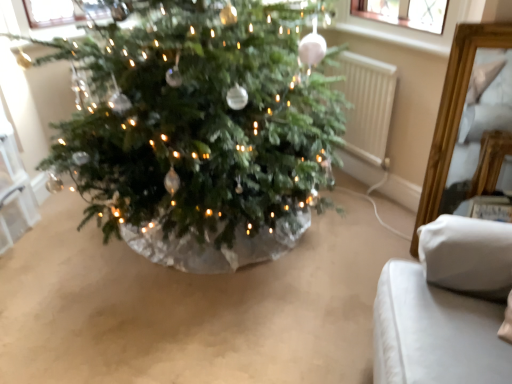
Question: In the image, is white plastic radiator at center right on the left side or the right side of white fabric cushion at lower right?

Choices:
 (A) left
 (B) right

Answer: (A)

Question: Is white plastic radiator at center right taller or shorter than white fabric cushion at lower right?

Choices:
 (A) short
 (B) tall

Answer: (A)

Question: From a real-world perspective, is white plastic radiator at center right positioned above or below white fabric cushion at lower right?

Choices:
 (A) below
 (B) above

Answer: (A)

Question: Choose the correct answer: Is white fabric cushion at lower right inside white plastic radiator at center right or outside it?

Choices:
 (A) outside
 (B) inside

Answer: (A)

Question: From the image's perspective, relative to white plastic radiator at center right, is white fabric cushion at lower right above or below?

Choices:
 (A) above
 (B) below

Answer: (B)

Question: Looking at their shapes, would you say white fabric cushion at lower right is wider or thinner than white plastic radiator at center right?

Choices:
 (A) thin
 (B) wide

Answer: (B)

Question: In terms of size, does white fabric cushion at lower right appear bigger or smaller than white plastic radiator at center right?

Choices:
 (A) small
 (B) big

Answer: (B)